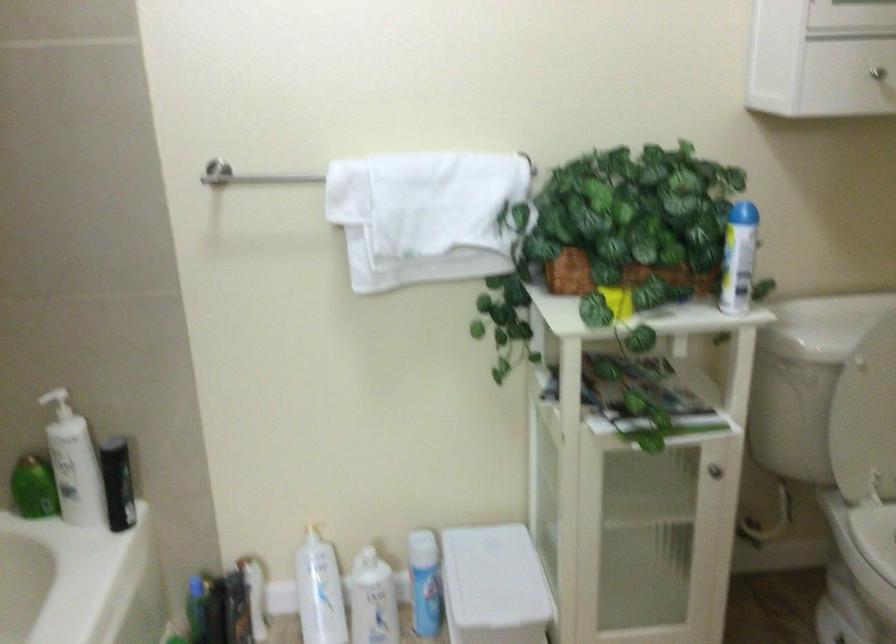
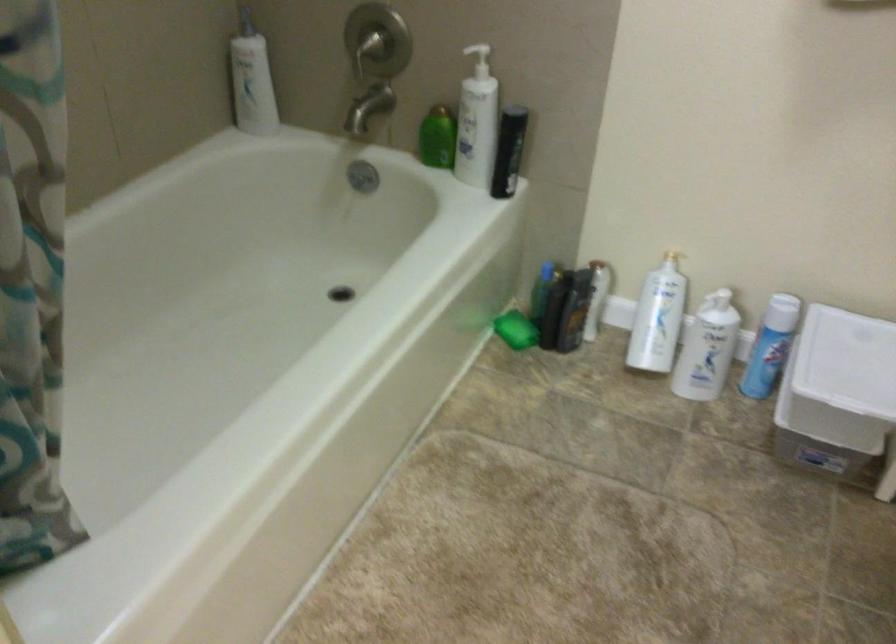
The point at [124,483] is marked in the first image. Where is the corresponding point in the second image?

(509, 152)